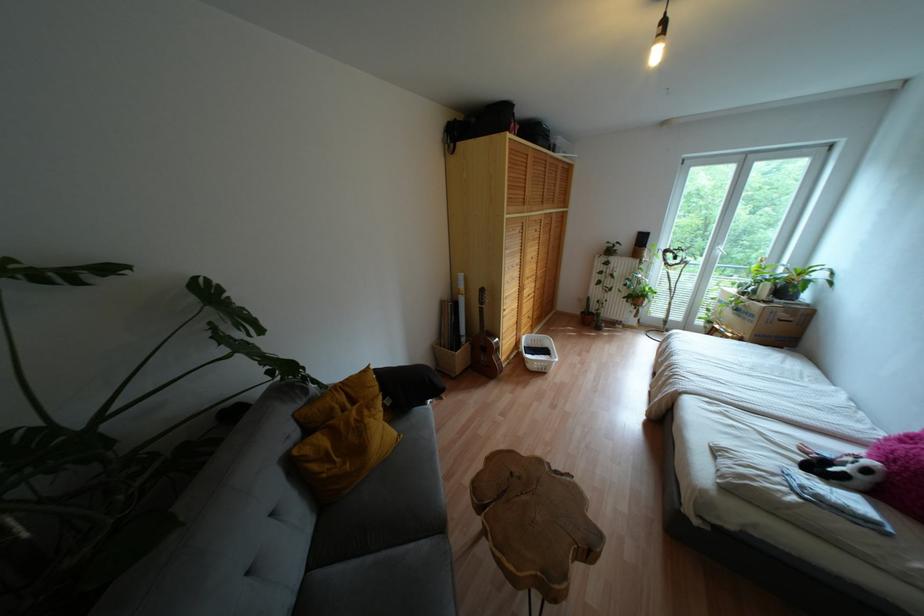
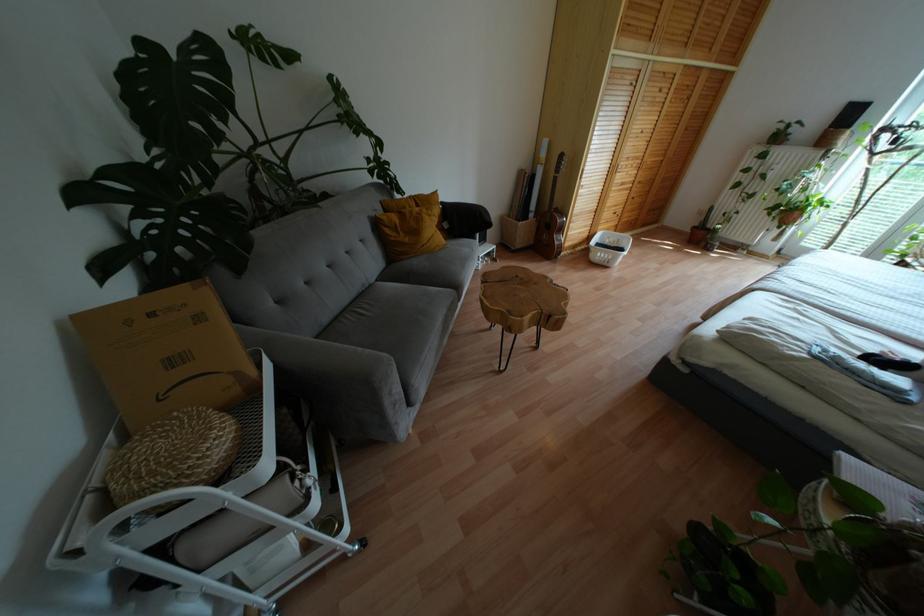
The point at (580, 313) is marked in the first image. Where is the corresponding point in the second image?

(694, 227)